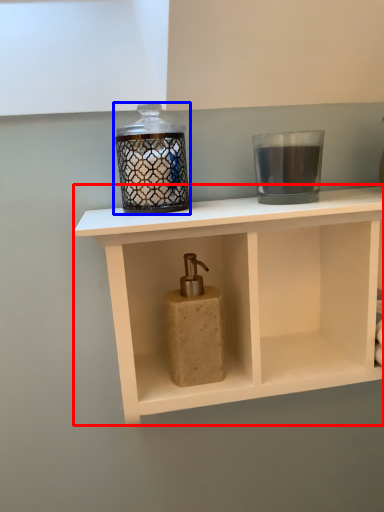
Question: Which of the following is the closest to the observer, shelf (highlighted by a red box) or candle holder (highlighted by a blue box)?

Choices:
 (A) shelf
 (B) candle holder

Answer: (A)